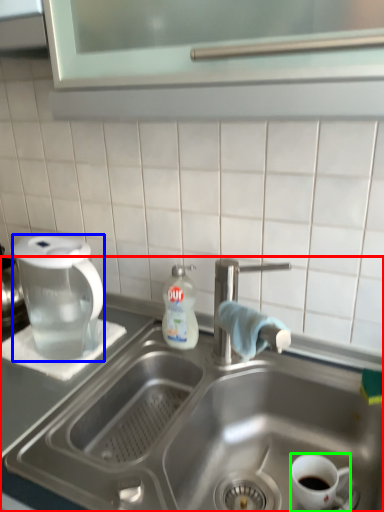
Question: Considering the real-world distances, which object is farthest from sink (highlighted by a red box)? coffee maker (highlighted by a blue box) or coffee cup (highlighted by a green box)?

Choices:
 (A) coffee maker
 (B) coffee cup

Answer: (A)